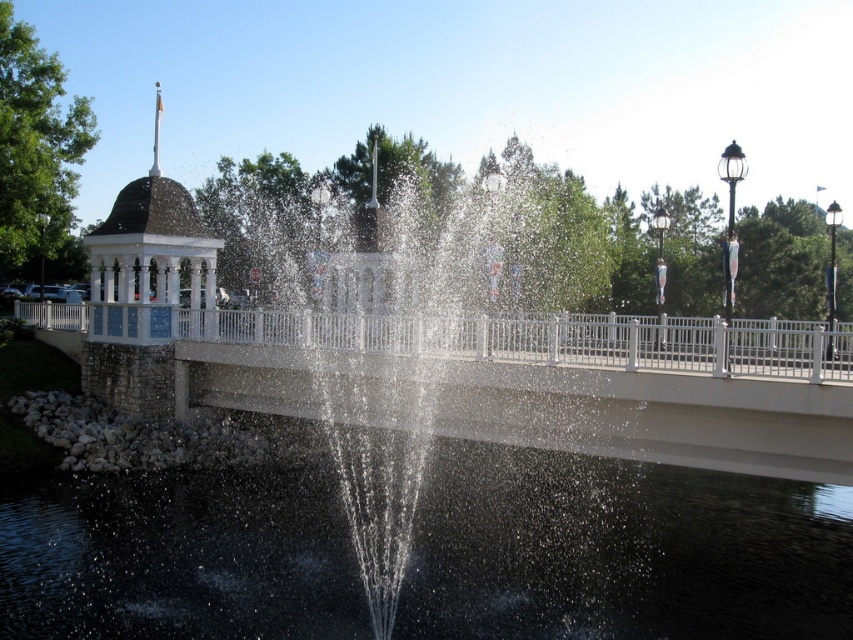
You are standing on the white concrete bridge at center and want to cross to the other side. The clear liquid water at center is flowing beneath you. Can you safely walk across the bridge without stepping into the water?

The clear liquid water at center occupies less space than the white concrete bridge at center, so yes, you can safely walk across the bridge without stepping into the water because the bridge is wider than the water area below.

You are standing on the white concrete bridge at center and want to pour a drink into the clear liquid water at center. Which direction should you move to ensure the drink lands in the water?

The clear liquid water at center is positioned on the right side of the white concrete bridge at center, so you should move to your right to pour the drink into the clear liquid water at center.